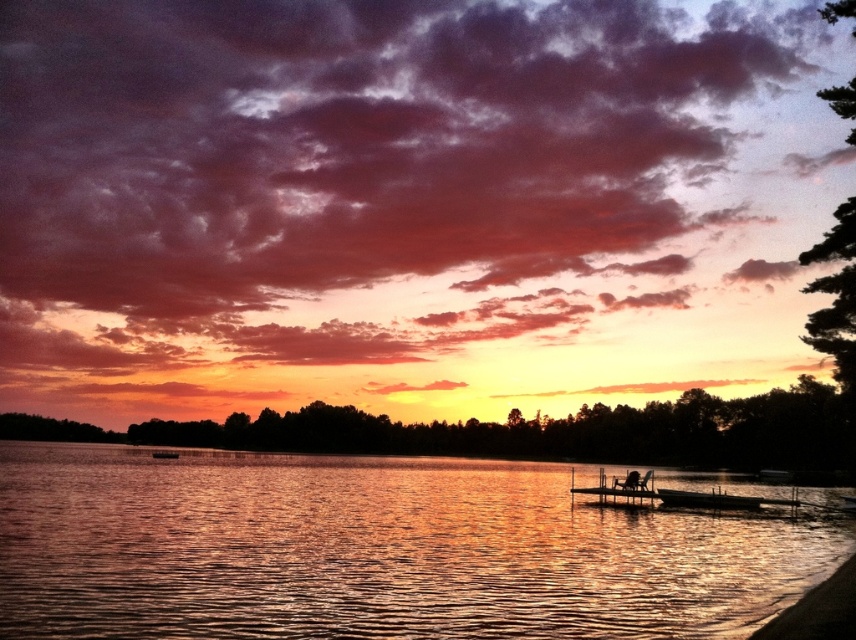
Question: Which point is closer to the camera?

Choices:
 (A) smooth sand at lower right
 (B) brown wooden canoe at center

Answer: (A)

Question: Which is nearer to the wooden dock at center?

Choices:
 (A) brown wooden canoe at center
 (B) dark brown wooden boat at center
 (C) smooth sand at lower right
 (D) glistening water at center

Answer: (A)

Question: Can you confirm if wooden dock at center is bigger than dark brown wooden boat at center?

Choices:
 (A) no
 (B) yes

Answer: (B)

Question: Which of the following is the farthest from the observer?

Choices:
 (A) wooden dock at center
 (B) brown wooden canoe at center
 (C) smooth sand at lower right
 (D) dark brown wooden boat at center

Answer: (D)

Question: Can you confirm if glistening water at center is positioned above wooden dock at center?

Choices:
 (A) yes
 (B) no

Answer: (A)

Question: Is smooth sand at lower right positioned before brown wooden canoe at center?

Choices:
 (A) no
 (B) yes

Answer: (B)